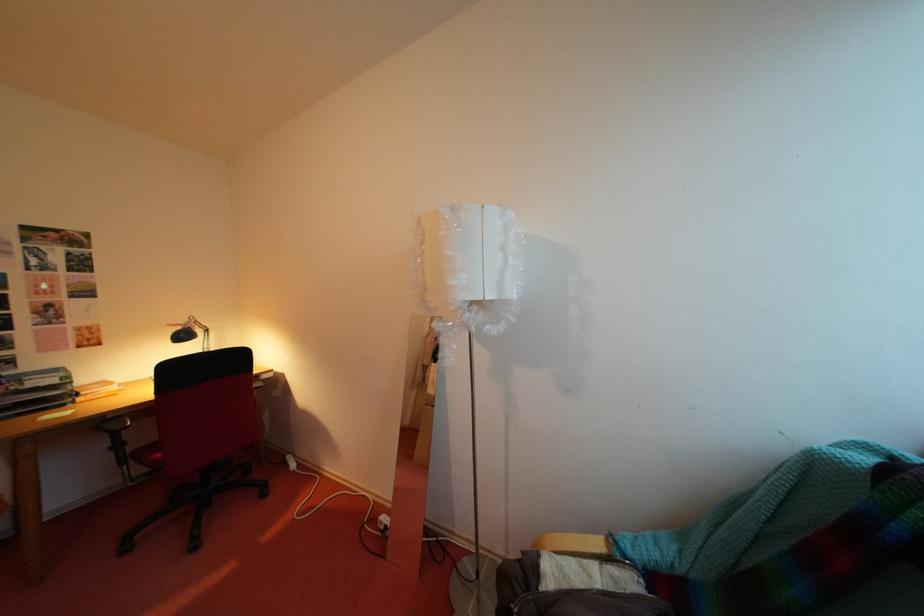
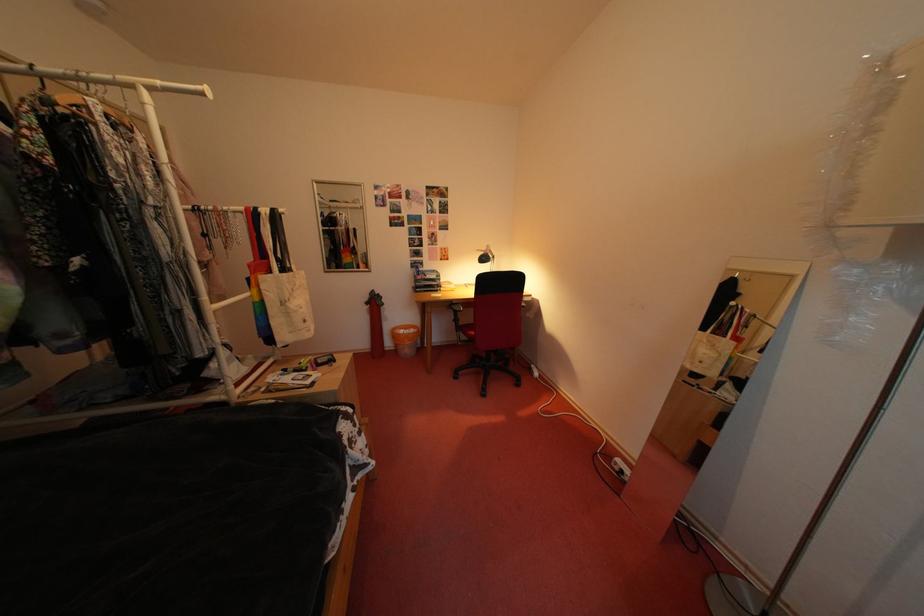
Locate, in the second image, the point that corresponds to point 189,333 in the first image.

(492, 257)